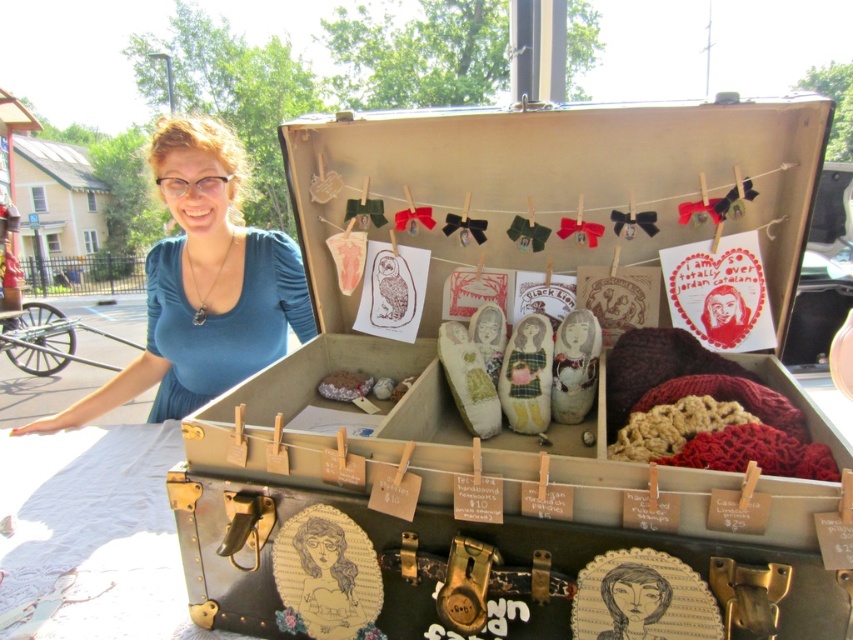
Question: Is teal fabric at left wider than brushed metal cart at left?

Choices:
 (A) no
 (B) yes

Answer: (A)

Question: Considering the real-world distances, which object is farthest from the metallic suitcase at center?

Choices:
 (A) teal fabric at left
 (B) brushed metal cart at left
 (C) black paper at center

Answer: (B)

Question: Considering the real-world distances, which object is farthest from the teal fabric at left?

Choices:
 (A) brushed metal cart at left
 (B) metallic suitcase at center

Answer: (A)

Question: Does brushed metal cart at left appear over black paper at center?

Choices:
 (A) no
 (B) yes

Answer: (B)

Question: Is the position of teal fabric at left less distant than that of brushed metal cart at left?

Choices:
 (A) no
 (B) yes

Answer: (B)

Question: Which point is farther to the camera?

Choices:
 (A) teal fabric at left
 (B) brushed metal cart at left

Answer: (B)